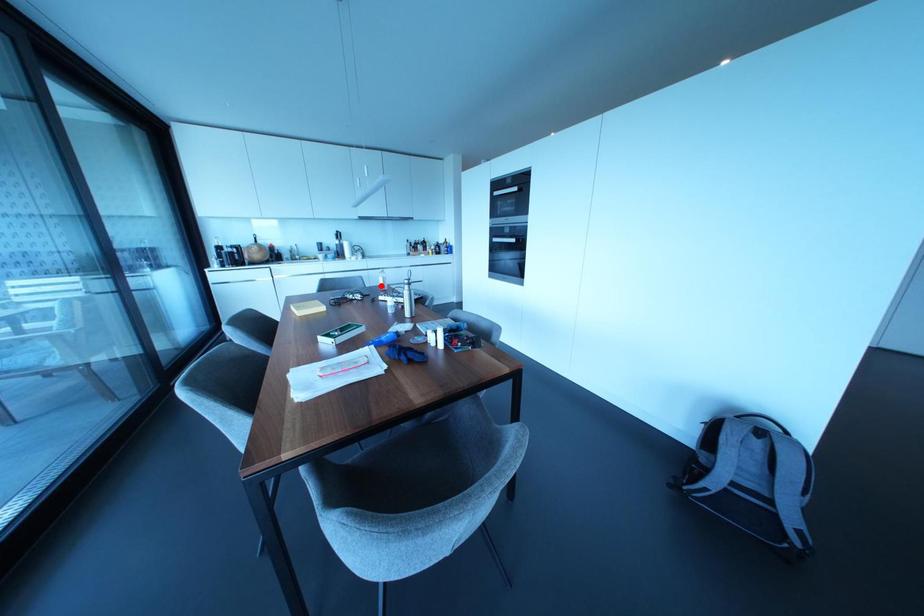
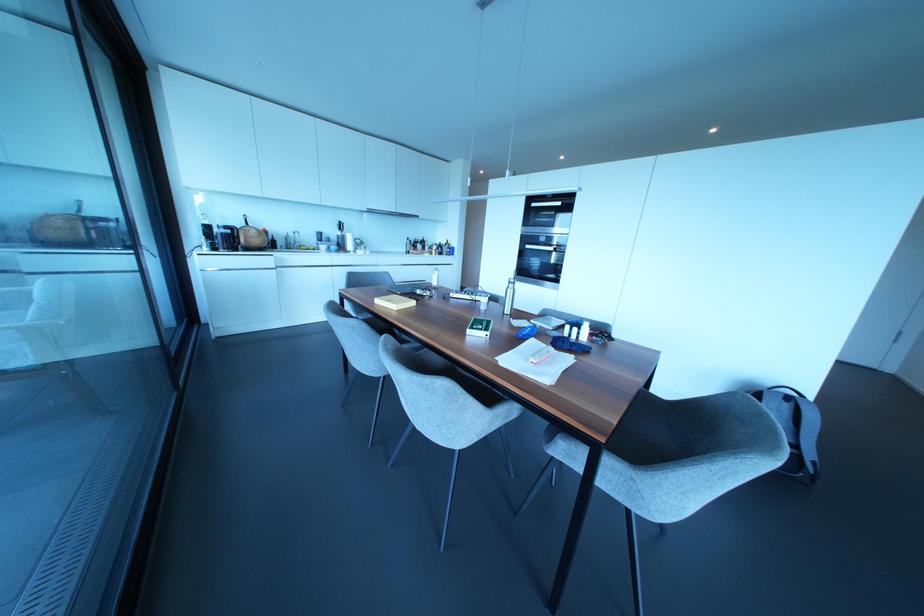
Question: I am providing you with two images of the same scene from different viewpoints. In image1, a red point is highlighted. Considering the same 3D point in image2, which of the following is correct?

Choices:
 (A) It is closer
 (B) It is farther

Answer: (A)